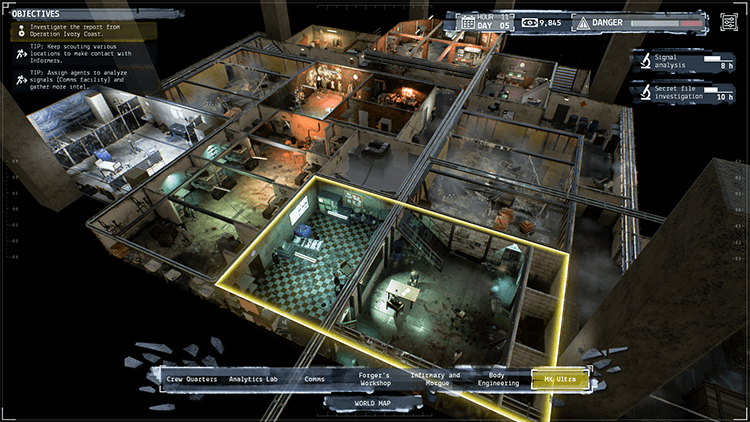
Find the location of a particular element. bed is located at coordinates (110, 165).